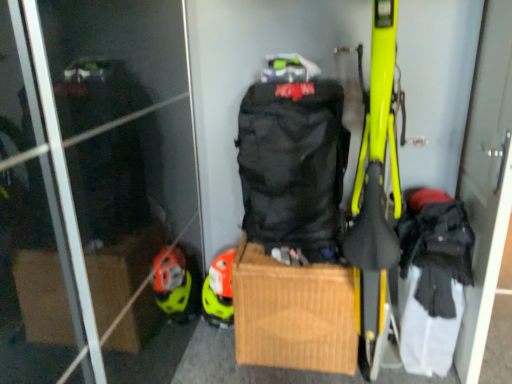
Question: Is black matte backpack at center positioned far away from black fabric backpack at right?

Choices:
 (A) no
 (B) yes

Answer: (A)

Question: Is black matte backpack at center thinner than black fabric backpack at right?

Choices:
 (A) yes
 (B) no

Answer: (B)

Question: Is black matte backpack at center further to camera compared to black fabric backpack at right?

Choices:
 (A) no
 (B) yes

Answer: (B)

Question: From the image's perspective, is black matte backpack at center on black fabric backpack at right?

Choices:
 (A) no
 (B) yes

Answer: (B)

Question: From a real-world perspective, is black matte backpack at center physically below black fabric backpack at right?

Choices:
 (A) no
 (B) yes

Answer: (A)

Question: Is brown cardboard box at center taller or shorter than black fabric backpack at right?

Choices:
 (A) tall
 (B) short

Answer: (B)

Question: From a real-world perspective, is brown cardboard box at center physically located above or below black fabric backpack at right?

Choices:
 (A) above
 (B) below

Answer: (B)

Question: Looking at their shapes, would you say brown cardboard box at center is wider or thinner than black fabric backpack at right?

Choices:
 (A) wide
 (B) thin

Answer: (A)

Question: Is brown cardboard box at center in front of or behind black fabric backpack at right in the image?

Choices:
 (A) behind
 (B) front

Answer: (A)

Question: Is brown cardboard box at center situated inside black matte backpack at center or outside?

Choices:
 (A) inside
 (B) outside

Answer: (B)

Question: Is brown cardboard box at center to the left or to the right of black matte backpack at center in the image?

Choices:
 (A) right
 (B) left

Answer: (A)

Question: Does point (296, 284) appear closer or farther from the camera than point (274, 200)?

Choices:
 (A) farther
 (B) closer

Answer: (A)

Question: Based on their sizes in the image, would you say brown cardboard box at center is bigger or smaller than black matte backpack at center?

Choices:
 (A) small
 (B) big

Answer: (B)

Question: Looking at the image, does black matte backpack at center seem bigger or smaller compared to brown cardboard box at center?

Choices:
 (A) big
 (B) small

Answer: (B)

Question: Is black matte backpack at center taller or shorter than brown cardboard box at center?

Choices:
 (A) tall
 (B) short

Answer: (A)